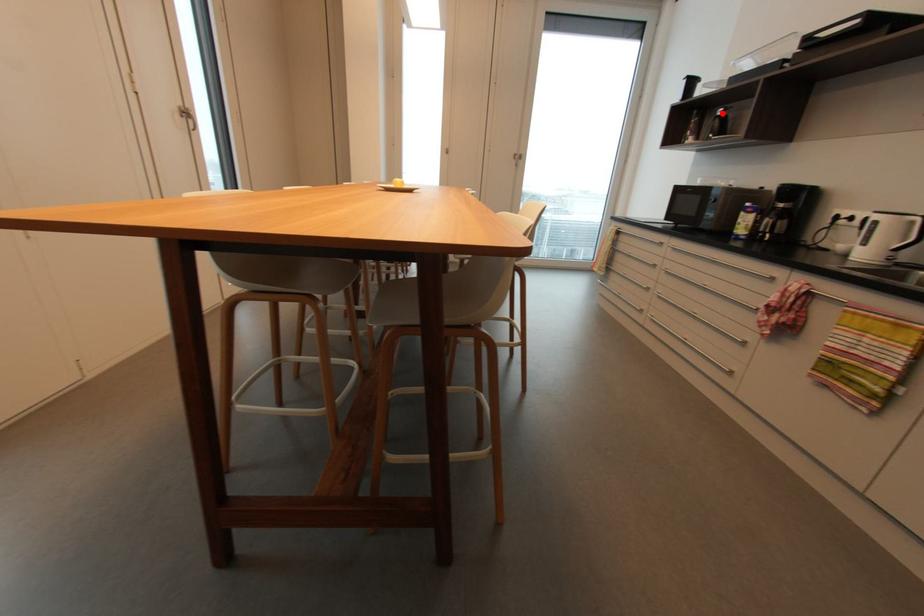
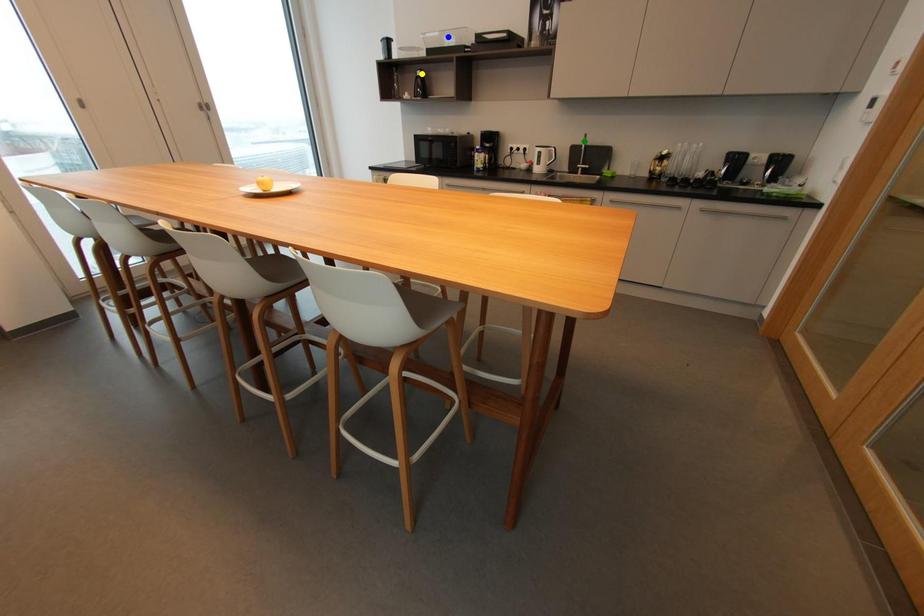
Question: I am providing you with two images of the same scene from different viewpoints. A red point is marked on the first image. You are given multiple points on the second image. Which point in image 2 is actually the same real-world point as the red point in image 1?

Choices:
 (A) green point
 (B) yellow point
 (C) blue point

Answer: (B)